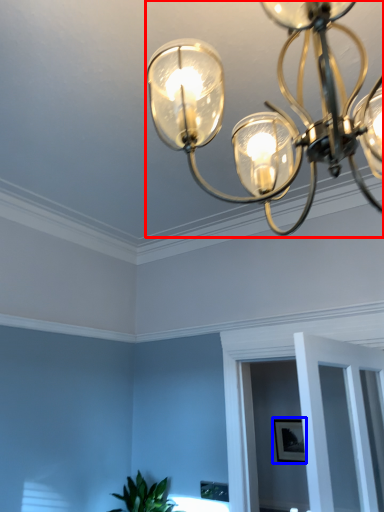
Question: Which object is closer to the camera taking this photo, lamp (highlighted by a red box) or picture frame (highlighted by a blue box)?

Choices:
 (A) lamp
 (B) picture frame

Answer: (A)